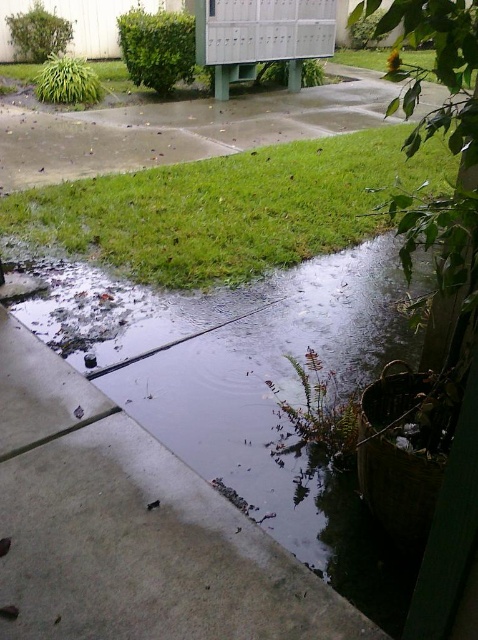
You are standing at the point labeled as point (130, 528) in the image. Looking around, you see the gray concrete pavement at lower center. What is the surface you are currently standing on?

The point (130, 528) corresponds to the gray concrete pavement at lower center, so you are standing on the gray concrete pavement at lower center.